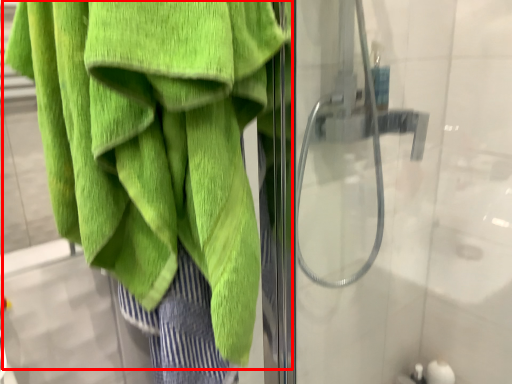
Question: From the image, what is the correct spatial relationship of towel (annotated by the red box) in relation to screen door?

Choices:
 (A) right
 (B) left

Answer: (B)